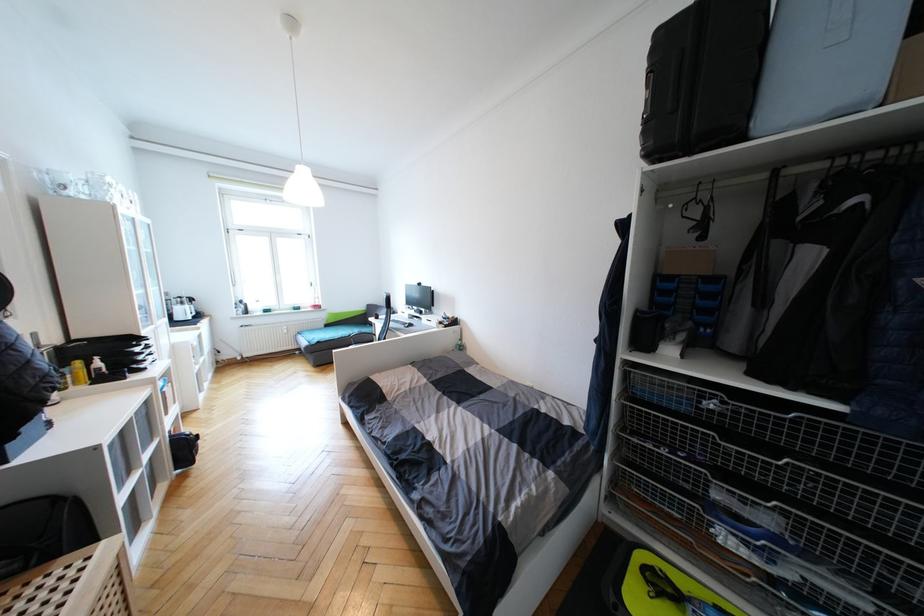
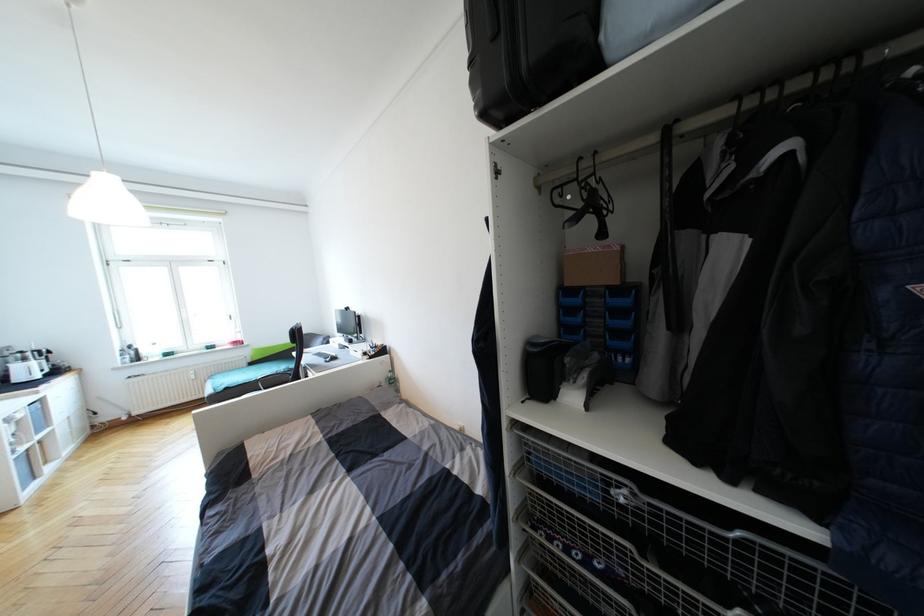
Find the pixel in the second image that matches (702,277) in the first image.

(611, 288)